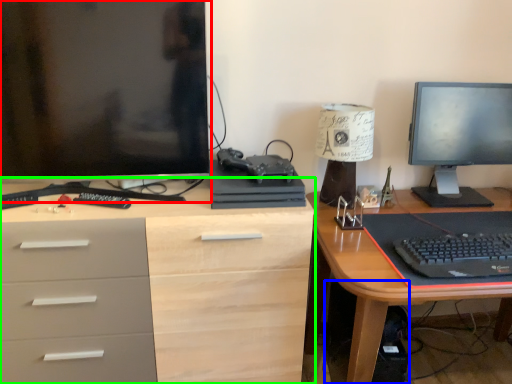
Question: Which is nearer to the computer monitor (highlighted by a red box)? computer tower (highlighted by a blue box) or desk (highlighted by a green box).

Choices:
 (A) computer tower
 (B) desk

Answer: (B)